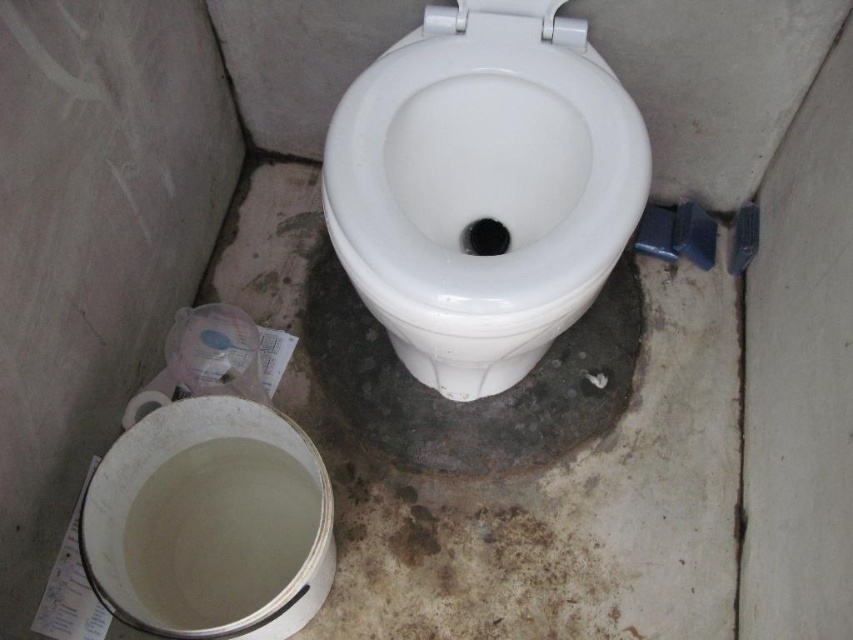
Question: Can you confirm if white glossy toilet bowl at center is positioned to the right of white glossy toilet bowl at lower left?

Choices:
 (A) no
 (B) yes

Answer: (B)

Question: Which object appears farthest from the camera in this image?

Choices:
 (A) white glossy toilet bowl at center
 (B) white glossy toilet bowl at lower left

Answer: (B)

Question: Among these points, which one is farthest from the camera?

Choices:
 (A) (547, 257)
 (B) (149, 458)

Answer: (B)

Question: Does white glossy toilet bowl at center appear over white glossy toilet bowl at lower left?

Choices:
 (A) yes
 (B) no

Answer: (A)

Question: Which point is closer to the camera?

Choices:
 (A) (142, 484)
 (B) (418, 300)

Answer: (B)

Question: Is white glossy toilet bowl at center in front of white glossy toilet bowl at lower left?

Choices:
 (A) yes
 (B) no

Answer: (A)